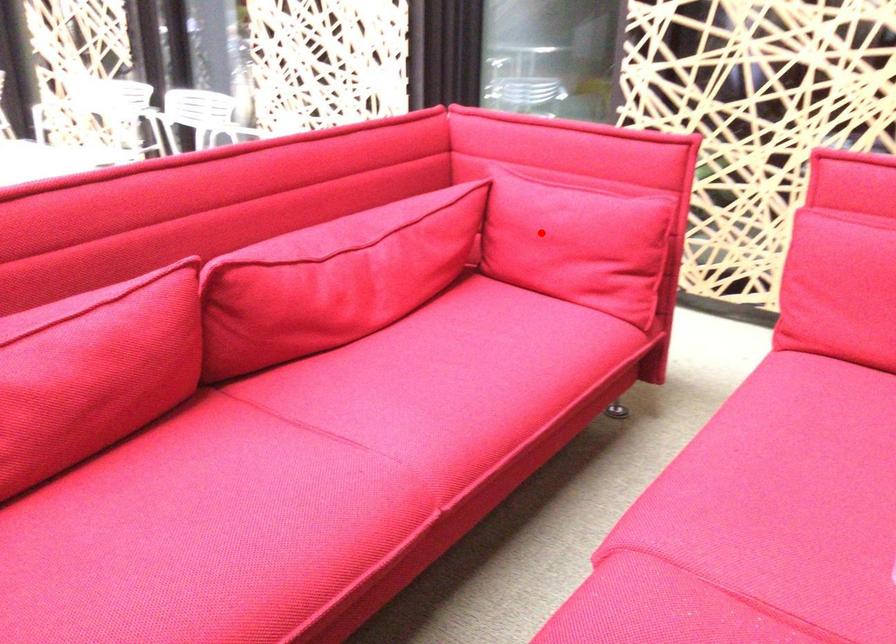
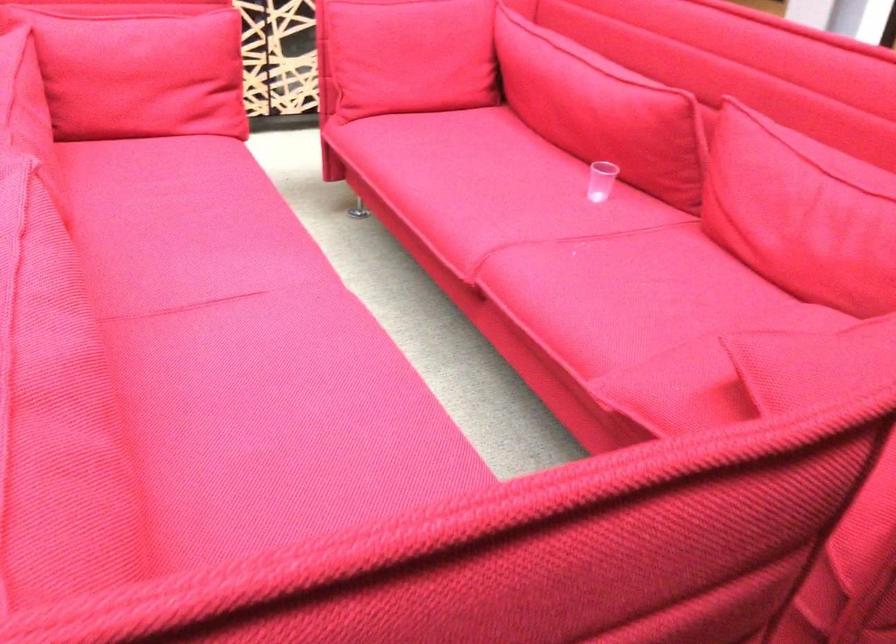
Find the pixel in the second image that matches the highlighted location in the first image.

(142, 76)